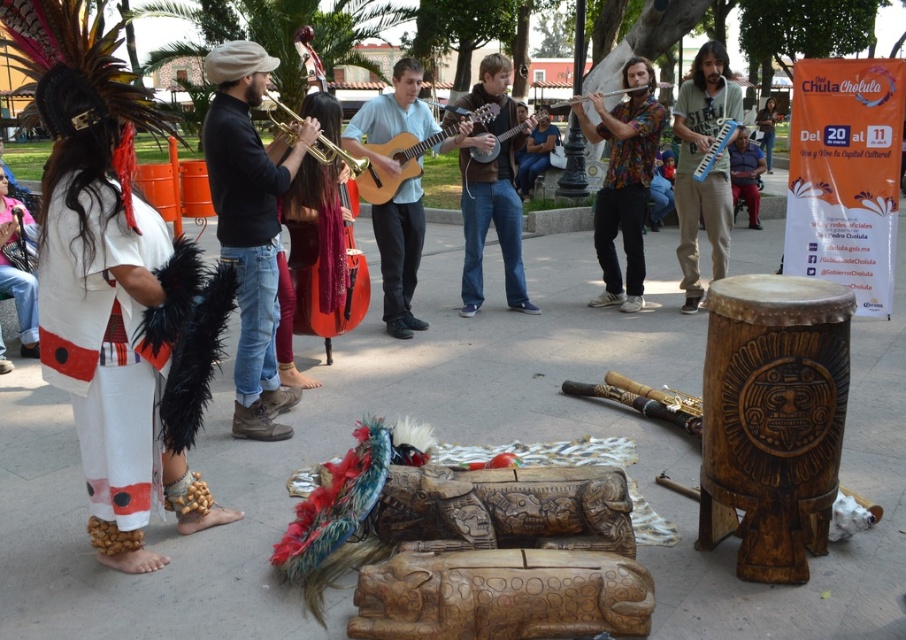
You are a photographer setting up for the performance. You need to position your camera so that both the matte brown guitar at center and the wooden flute at center are in frame. Considering their heights, which object should you focus on first to ensure both are visible?

The matte brown guitar at center is not as tall as the wooden flute at center, so you should focus on the wooden flute at center first to ensure both are visible in the frame.

You are a photographer at the event and want to capture both the matte brown guitar at center and the wooden flute at center in your shot. Which one is positioned higher in the frame?

The matte brown guitar at center is located above the wooden flute at center, so it is positioned higher in the frame.